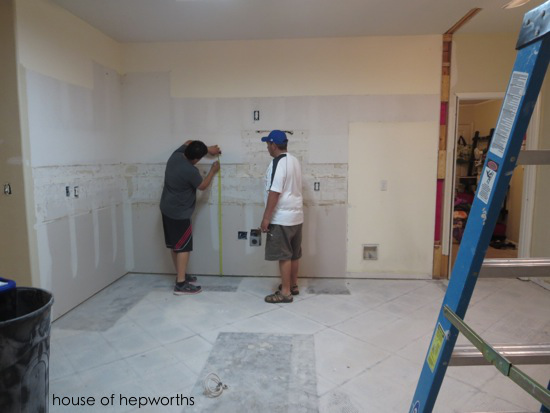
What are the coordinates of `wall` in the screenshot? It's located at (296, 78).